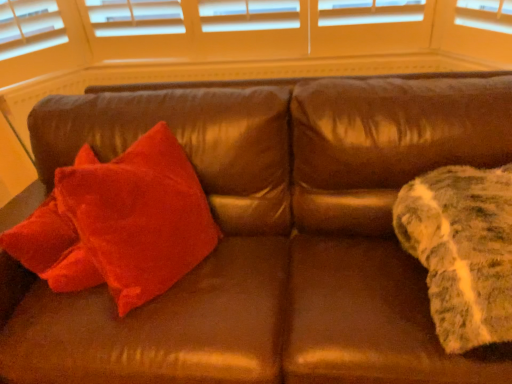
Question: Considering the positions of velvet red pillow at left and fuzzy white blanket at right in the image, is velvet red pillow at left bigger or smaller than fuzzy white blanket at right?

Choices:
 (A) small
 (B) big

Answer: (B)

Question: Is velvet red pillow at left situated inside fuzzy white blanket at right or outside?

Choices:
 (A) outside
 (B) inside

Answer: (A)

Question: Is velvet red pillow at left wider or thinner than fuzzy white blanket at right?

Choices:
 (A) thin
 (B) wide

Answer: (A)

Question: From their relative heights in the image, would you say fuzzy white blanket at right is taller or shorter than velvet red pillow at left?

Choices:
 (A) tall
 (B) short

Answer: (B)

Question: From a real-world perspective, is fuzzy white blanket at right above or below velvet red pillow at left?

Choices:
 (A) above
 (B) below

Answer: (A)

Question: Considering the positions of fuzzy white blanket at right and velvet red pillow at left in the image, is fuzzy white blanket at right wider or thinner than velvet red pillow at left?

Choices:
 (A) thin
 (B) wide

Answer: (B)

Question: In the image, is fuzzy white blanket at right positioned in front of or behind velvet red pillow at left?

Choices:
 (A) behind
 (B) front

Answer: (B)